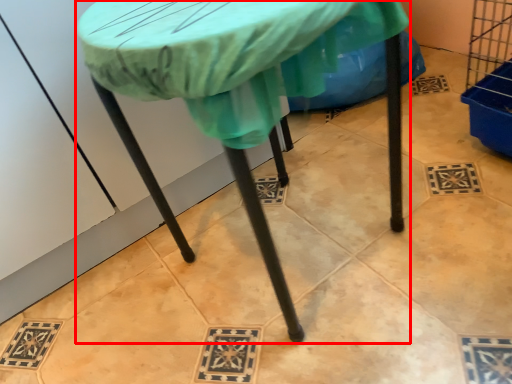
Question: From the image's perspective, what is the correct spatial relationship of table (annotated by the red box) in relation to fabric?

Choices:
 (A) above
 (B) below

Answer: (B)